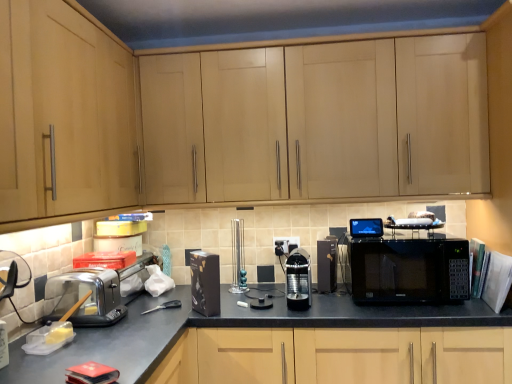
Question: Should I look upward or downward to see sleek black coffee machine at center, the 2th appliance positioned from the right?

Choices:
 (A) up
 (B) down

Answer: (B)

Question: Considering the relative sizes of light wood cabinet at upper center, acting as the first cabinetry starting from the back, and black glossy microwave at center in the image provided, is light wood cabinet at upper center, acting as the first cabinetry starting from the back, thinner than black glossy microwave at center?

Choices:
 (A) yes
 (B) no

Answer: (A)

Question: Is light wood cabinet at upper center, which appears as the 2th cabinetry when viewed from the front, positioned beyond the bounds of black glossy microwave at center?

Choices:
 (A) no
 (B) yes

Answer: (B)

Question: Is light wood cabinet at upper center, which appears as the 2th cabinetry when viewed from the front, at the right side of black glossy microwave at center?

Choices:
 (A) yes
 (B) no

Answer: (B)

Question: From the image's perspective, is light wood cabinet at upper center, which appears as the 2th cabinetry when viewed from the front, below black glossy microwave at center?

Choices:
 (A) no
 (B) yes

Answer: (A)

Question: Considering the relative sizes of light wood cabinet at upper center, acting as the first cabinetry starting from the back, and black glossy microwave at center in the image provided, is light wood cabinet at upper center, acting as the first cabinetry starting from the back, bigger than black glossy microwave at center?

Choices:
 (A) yes
 (B) no

Answer: (A)

Question: Is light wood cabinet at upper center, which is counted as the 1th cabinetry, starting from the right, looking in the opposite direction of black glossy microwave at center?

Choices:
 (A) yes
 (B) no

Answer: (B)

Question: Are clear plastic toaster at lower left and black plastic electric outlet at center located far from each other?

Choices:
 (A) no
 (B) yes

Answer: (A)

Question: Considering the relative positions of clear plastic toaster at lower left and black plastic electric outlet at center in the image provided, is clear plastic toaster at lower left to the right of black plastic electric outlet at center from the viewer's perspective?

Choices:
 (A) no
 (B) yes

Answer: (A)

Question: Is clear plastic toaster at lower left smaller than black plastic electric outlet at center?

Choices:
 (A) yes
 (B) no

Answer: (B)

Question: Can you confirm if clear plastic toaster at lower left is wider than black plastic electric outlet at center?

Choices:
 (A) no
 (B) yes

Answer: (B)

Question: From the image's perspective, is clear plastic toaster at lower left located above black plastic electric outlet at center?

Choices:
 (A) yes
 (B) no

Answer: (B)

Question: Is clear plastic toaster at lower left not within black plastic electric outlet at center?

Choices:
 (A) no
 (B) yes

Answer: (B)

Question: From the image's perspective, is black matte box at center, marked as the 1th appliance in a left-to-right arrangement, below black glossy microwave at center?

Choices:
 (A) yes
 (B) no

Answer: (A)